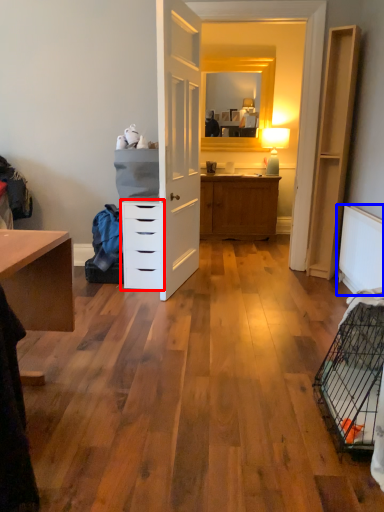
Question: Which of the following is the closest to the observer, chest of drawers (highlighted by a red box) or radiator (highlighted by a blue box)?

Choices:
 (A) chest of drawers
 (B) radiator

Answer: (B)